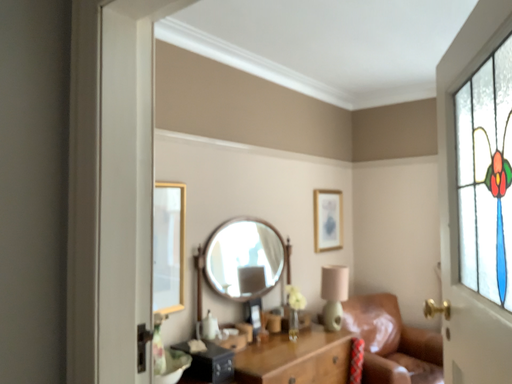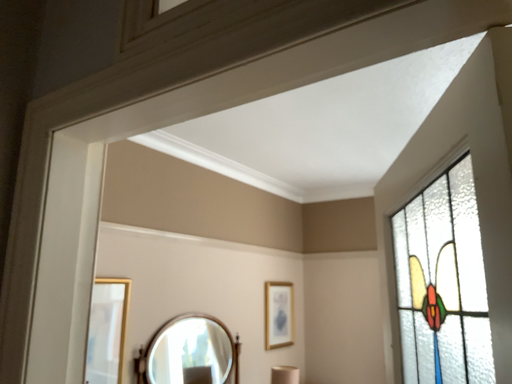
Question: Which way did the camera rotate in the video?

Choices:
 (A) rotated upward
 (B) rotated downward

Answer: (A)